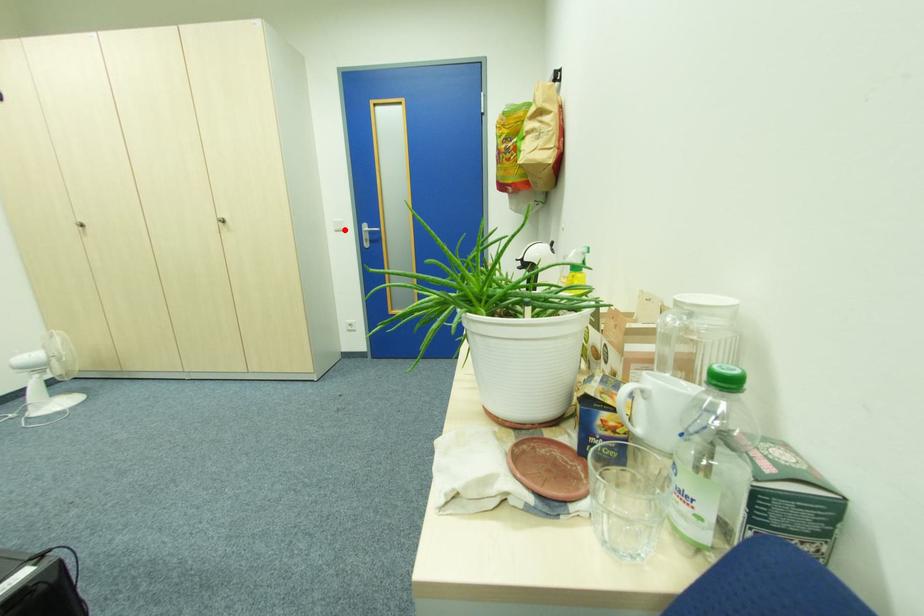
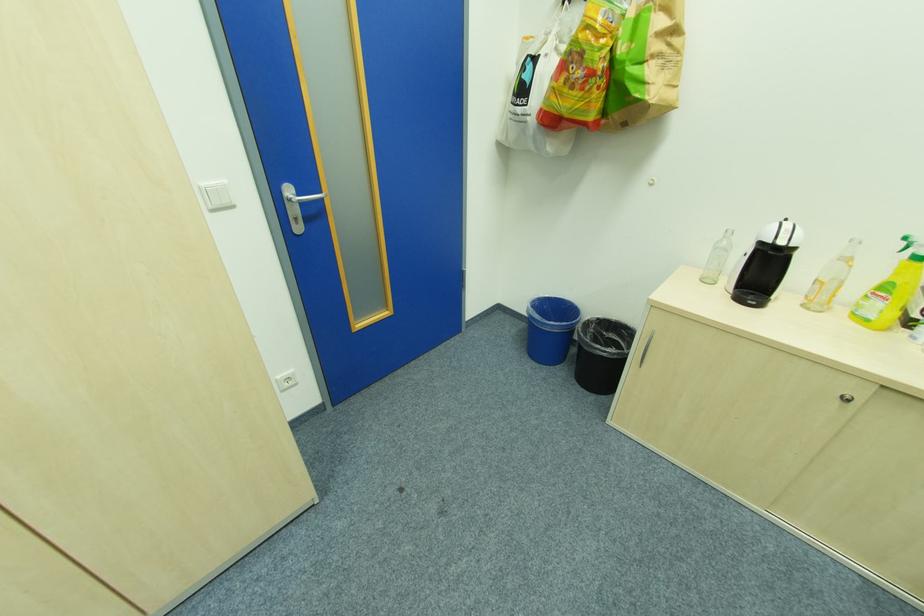
Where in the second image is the point corresponding to the highlighted location from the first image?

(232, 204)